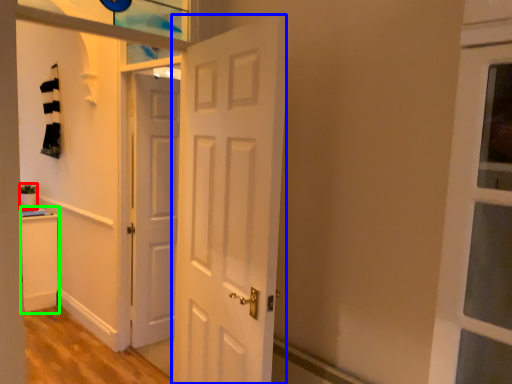
Question: Which object is positioned closest to houseplant (highlighted by a red box)? Select from door (highlighted by a blue box) and cabinetry (highlighted by a green box).

Choices:
 (A) door
 (B) cabinetry

Answer: (B)